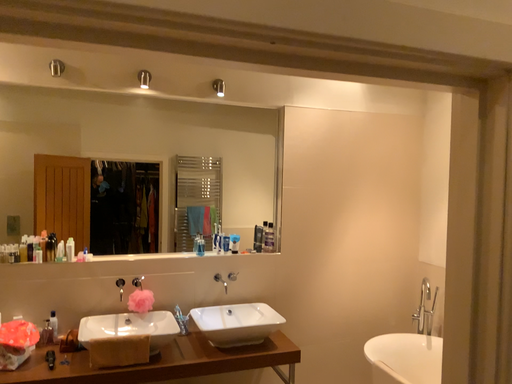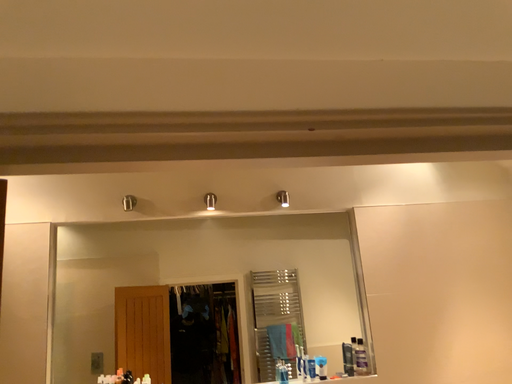
Question: How did the camera likely rotate when shooting the video?

Choices:
 (A) rotated right
 (B) rotated left

Answer: (B)